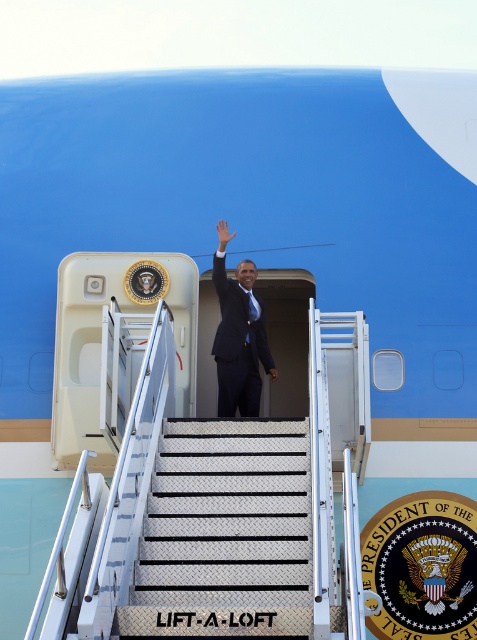
Looking at this image, who is shorter, dark blue suit at center or white matte hand at center?

white matte hand at center

Is dark blue suit at center shorter than white matte hand at center?

In fact, dark blue suit at center may be taller than white matte hand at center.

You are a GUI agent. You are given a task and a screenshot of the screen. Output one action in this format:
    pyautogui.click(x=<x>, y=<y>)
    Task: Click on the dark blue suit at center
    This screenshot has width=477, height=640.
    Given the screenshot: What is the action you would take?
    pyautogui.click(x=238, y=339)

Measure the distance from diamond plate metal stairs at center to dark blue suit at center.

diamond plate metal stairs at center and dark blue suit at center are 1.76 meters apart.

Who is lower down, diamond plate metal stairs at center or dark blue suit at center?

diamond plate metal stairs at center

I want to click on diamond plate metal stairs at center, so click(x=225, y=532).

Who is positioned more to the right, diamond plate metal stairs at center or white matte hand at center?

diamond plate metal stairs at center is more to the right.

Is diamond plate metal stairs at center above white matte hand at center?

Incorrect, diamond plate metal stairs at center is not positioned above white matte hand at center.

Does point (263, 500) lie behind point (228, 237)?

That is False.

Where is `diamond plate metal stairs at center`? The width and height of the screenshot is (477, 640). diamond plate metal stairs at center is located at coordinates (225, 532).